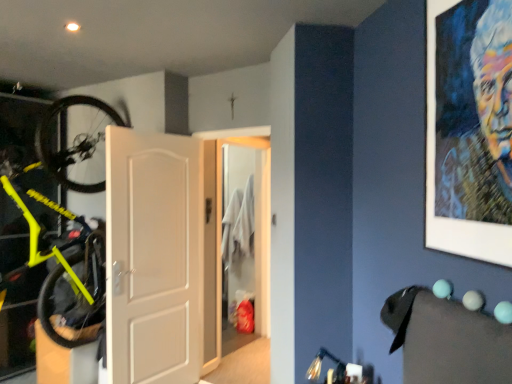
Question: From a real-world perspective, is oil painting portrait at upper right physically below white matte door at center, which is the 1th door in front-to-back order?

Choices:
 (A) yes
 (B) no

Answer: (B)

Question: Considering the relative positions of oil painting portrait at upper right and white matte door at center, positioned as the second door in back-to-front order, in the image provided, is oil painting portrait at upper right behind white matte door at center, positioned as the second door in back-to-front order,?

Choices:
 (A) yes
 (B) no

Answer: (B)

Question: Can you confirm if oil painting portrait at upper right is shorter than white matte door at center, the second door positioned from the right?

Choices:
 (A) no
 (B) yes

Answer: (B)

Question: From a real-world perspective, is oil painting portrait at upper right located higher than white matte door at center, positioned as the 1th door in left-to-right order?

Choices:
 (A) yes
 (B) no

Answer: (A)

Question: Can you confirm if oil painting portrait at upper right is wider than white matte door at center, the second door positioned from the right?

Choices:
 (A) yes
 (B) no

Answer: (B)

Question: Is white matte door at center, positioned as the 1th door in left-to-right order, situated inside neon yellow matte bicycle at left or outside?

Choices:
 (A) inside
 (B) outside

Answer: (B)

Question: In terms of width, does white matte door at center, the second door positioned from the right, look wider or thinner when compared to neon yellow matte bicycle at left?

Choices:
 (A) wide
 (B) thin

Answer: (B)

Question: From the image's perspective, relative to neon yellow matte bicycle at left, is white matte door at center, positioned as the second door in back-to-front order, above or below?

Choices:
 (A) below
 (B) above

Answer: (A)

Question: Considering the relative positions of white matte door at center, positioned as the 1th door in left-to-right order, and neon yellow matte bicycle at left in the image provided, is white matte door at center, positioned as the 1th door in left-to-right order, to the left or to the right of neon yellow matte bicycle at left?

Choices:
 (A) left
 (B) right

Answer: (B)

Question: From the image's perspective, relative to white glossy door at center, positioned as the 2th door in left-to-right order, is neon yellow matte bicycle at left above or below?

Choices:
 (A) below
 (B) above

Answer: (B)

Question: Does point (77, 218) appear closer or farther from the camera than point (264, 188)?

Choices:
 (A) farther
 (B) closer

Answer: (B)

Question: Would you say neon yellow matte bicycle at left is to the left or to the right of white glossy door at center, positioned as the 2th door in left-to-right order, in the picture?

Choices:
 (A) right
 (B) left

Answer: (B)

Question: From a real-world perspective, is neon yellow matte bicycle at left above or below white glossy door at center, which is counted as the 2th door, starting from the front?

Choices:
 (A) above
 (B) below

Answer: (A)

Question: In terms of height, does oil painting portrait at upper right look taller or shorter compared to neon yellow matte bicycle at left?

Choices:
 (A) short
 (B) tall

Answer: (A)

Question: Which is correct: oil painting portrait at upper right is inside neon yellow matte bicycle at left, or outside of it?

Choices:
 (A) inside
 (B) outside

Answer: (B)